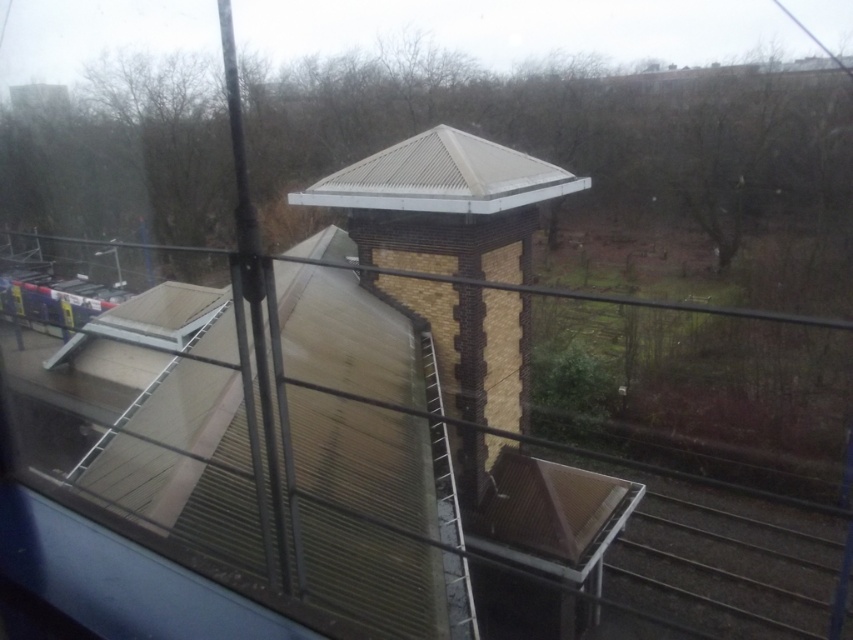
Is brick gazebo at center closer to camera compared to metallic corrugated roof at center?

That is True.

Find the location of a particular element. brick gazebo at center is located at coordinates [477, 339].

Locate an element on the screen. The width and height of the screenshot is (853, 640). brick gazebo at center is located at coordinates (477, 339).